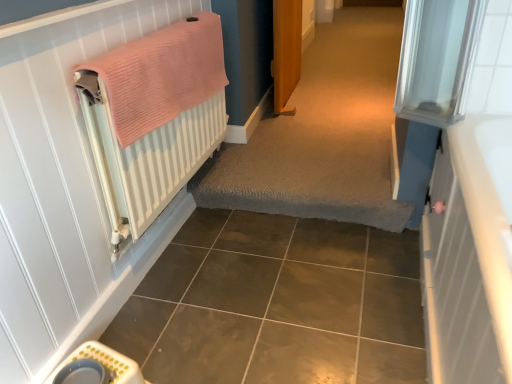
Question: Is textured carpet at center with white textured radiator at left?

Choices:
 (A) no
 (B) yes

Answer: (A)

Question: Is the position of textured carpet at center more distant than that of white textured radiator at left?

Choices:
 (A) yes
 (B) no

Answer: (A)

Question: Does textured carpet at center have a greater height compared to white textured radiator at left?

Choices:
 (A) no
 (B) yes

Answer: (A)

Question: Is textured carpet at center looking in the opposite direction of white textured radiator at left?

Choices:
 (A) no
 (B) yes

Answer: (A)

Question: Considering the relative sizes of textured carpet at center and white textured radiator at left in the image provided, is textured carpet at center thinner than white textured radiator at left?

Choices:
 (A) yes
 (B) no

Answer: (B)

Question: From a real-world perspective, is textured carpet at center on white textured radiator at left?

Choices:
 (A) no
 (B) yes

Answer: (A)

Question: Considering the relative sizes of brown glossy ceramic tile at lower center and white textured radiator at left in the image provided, is brown glossy ceramic tile at lower center smaller than white textured radiator at left?

Choices:
 (A) no
 (B) yes

Answer: (B)

Question: Does brown glossy ceramic tile at lower center appear on the left side of white textured radiator at left?

Choices:
 (A) no
 (B) yes

Answer: (A)

Question: Is brown glossy ceramic tile at lower center taller than white textured radiator at left?

Choices:
 (A) yes
 (B) no

Answer: (B)

Question: Is brown glossy ceramic tile at lower center further to camera compared to white textured radiator at left?

Choices:
 (A) no
 (B) yes

Answer: (A)

Question: Is brown glossy ceramic tile at lower center positioned with its back to white textured radiator at left?

Choices:
 (A) no
 (B) yes

Answer: (A)

Question: Can you confirm if brown glossy ceramic tile at lower center is shorter than white textured radiator at left?

Choices:
 (A) yes
 (B) no

Answer: (A)

Question: From a real-world perspective, is white textured radiator at left over pink knitted towel at left?

Choices:
 (A) no
 (B) yes

Answer: (A)